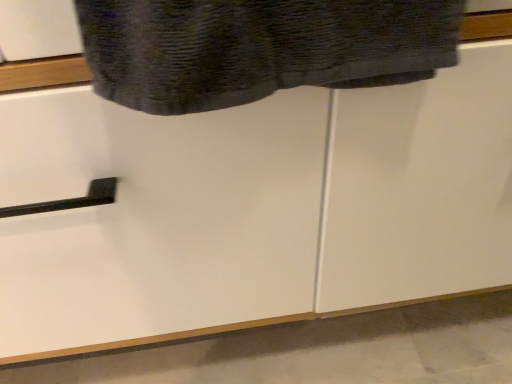
Question: Should I look upward or downward to see textured dark gray towel at upper center?

Choices:
 (A) up
 (B) down

Answer: (A)